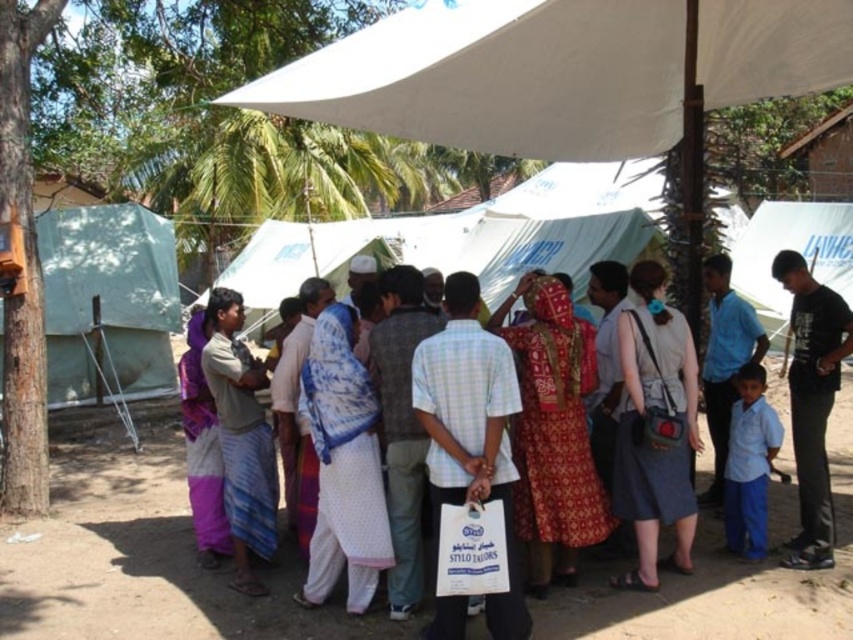
Looking at this image, can you confirm if white fabric canopy at upper center is thinner than light blue uniform at lower right?

In fact, white fabric canopy at upper center might be wider than light blue uniform at lower right.

Which of these two, white fabric canopy at upper center or light blue uniform at lower right, stands taller?

light blue uniform at lower right is taller.

Who is more distant from viewer, (494, 13) or (758, 496)?

Positioned behind is point (758, 496).

Where is `white fabric canopy at upper center`? This screenshot has width=853, height=640. white fabric canopy at upper center is located at coordinates (560, 72).

Does red printed dress at center appear over white dotted fabric at center?

Indeed, red printed dress at center is positioned over white dotted fabric at center.

Is red printed dress at center positioned before white dotted fabric at center?

That is False.

Does point (549, 472) come behind point (340, 358)?

Yes, it is behind point (340, 358).

At what (x,y) coordinates should I click in order to perform the action: click on red printed dress at center. Please return your answer as a coordinate pair (x, y). Image resolution: width=853 pixels, height=640 pixels. Looking at the image, I should click on (553, 432).

Is point (780, 280) positioned after point (747, 499)?

That is True.

Between black cotton shirt at right and light blue uniform at lower right, which one is positioned higher?

black cotton shirt at right is above.

What do you see at coordinates (811, 403) in the screenshot?
I see `black cotton shirt at right` at bounding box center [811, 403].

I want to click on black cotton shirt at right, so click(x=811, y=403).